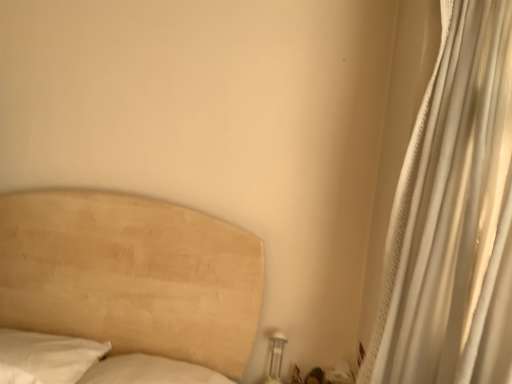
Question: In terms of width, does white textured curtain at right look wider or thinner when compared to white glossy table lamp at lower right?

Choices:
 (A) thin
 (B) wide

Answer: (B)

Question: Considering the positions of white textured curtain at right and white glossy table lamp at lower right in the image, is white textured curtain at right taller or shorter than white glossy table lamp at lower right?

Choices:
 (A) tall
 (B) short

Answer: (A)

Question: From the image's perspective, is white textured curtain at right positioned above or below white glossy table lamp at lower right?

Choices:
 (A) above
 (B) below

Answer: (A)

Question: From the image's perspective, relative to white textured curtain at right, is white glossy table lamp at lower right above or below?

Choices:
 (A) below
 (B) above

Answer: (A)

Question: Relative to white textured curtain at right, is white glossy table lamp at lower right in front or behind?

Choices:
 (A) behind
 (B) front

Answer: (A)

Question: From their relative heights in the image, would you say white glossy table lamp at lower right is taller or shorter than white textured curtain at right?

Choices:
 (A) tall
 (B) short

Answer: (B)

Question: Considering the relative positions of white glossy table lamp at lower right and white textured curtain at right in the image provided, is white glossy table lamp at lower right to the left or to the right of white textured curtain at right?

Choices:
 (A) right
 (B) left

Answer: (B)